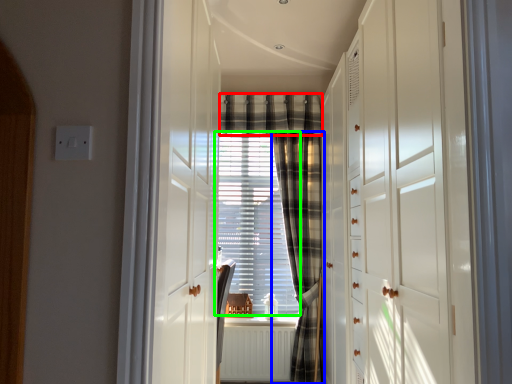
Question: Considering the real-world distances, which object is farthest from plaid (highlighted by a red box)? curtain (highlighted by a blue box) or window screen (highlighted by a green box)?

Choices:
 (A) curtain
 (B) window screen

Answer: (B)